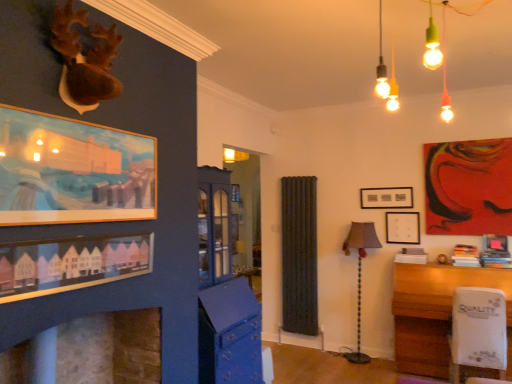
Locate an element on the screen. The height and width of the screenshot is (384, 512). empty space that is ontop of wooden framed painting at upper left, marked as the second picture frame in a front-to-back arrangement (from a real-world perspective) is located at coordinates (91, 113).